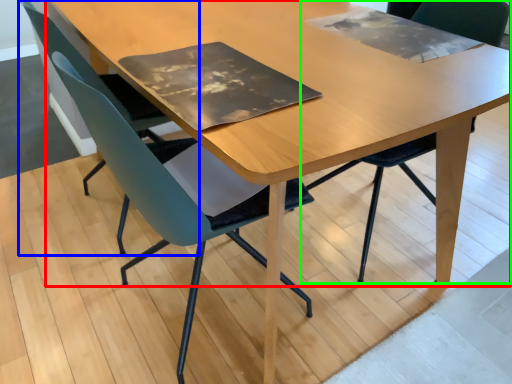
Question: Considering the real-world distances, which object is closest to table (highlighted by a red box)? chair (highlighted by a blue box) or chair (highlighted by a green box).

Choices:
 (A) chair
 (B) chair

Answer: (A)